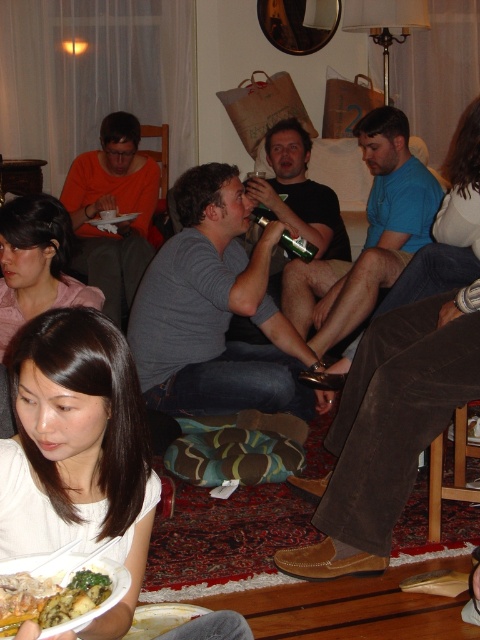
Question: Among these objects, which one is farthest from the camera?

Choices:
 (A) green glass bottle at center
 (B) pink fabric shirt at lower left
 (C) green leafy vegetables at lower left

Answer: (A)

Question: Is pink fabric shirt at lower left wider than green glass bottle at center?

Choices:
 (A) no
 (B) yes

Answer: (B)

Question: Considering the real-world distances, which object is farthest from the pink fabric shirt at lower left?

Choices:
 (A) green leafy vegetables at lower left
 (B) green glass bottle at center

Answer: (A)

Question: Which point appears closest to the camera in this image?

Choices:
 (A) (284, 234)
 (B) (55, 612)
 (C) (16, 273)

Answer: (B)

Question: Is green leafy vegetables at lower left behind green glass bottle at center?

Choices:
 (A) yes
 (B) no

Answer: (B)

Question: Does pink fabric shirt at lower left have a larger size compared to green glass bottle at center?

Choices:
 (A) yes
 (B) no

Answer: (B)